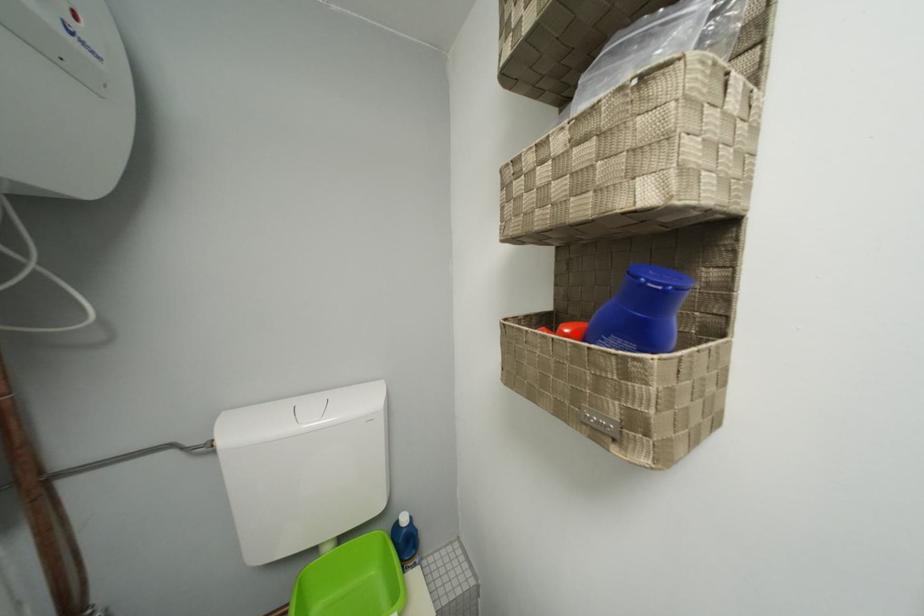
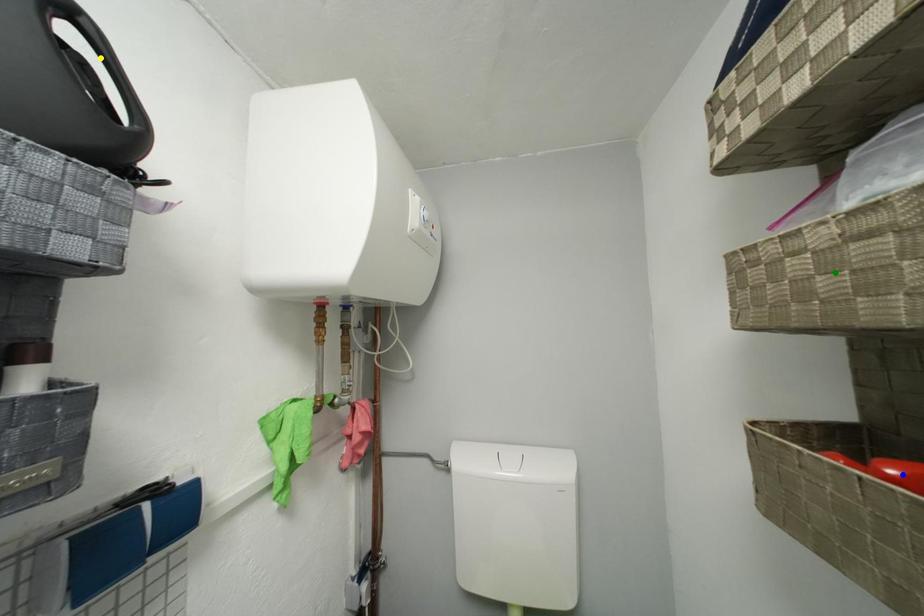
Question: I am providing you with two images of the same scene from different viewpoints. A red point is marked on the first image. You are given multiple points on the second image. Which spot in image 2 lines up with the point in image 1?

Choices:
 (A) green point
 (B) yellow point
 (C) blue point

Answer: (C)